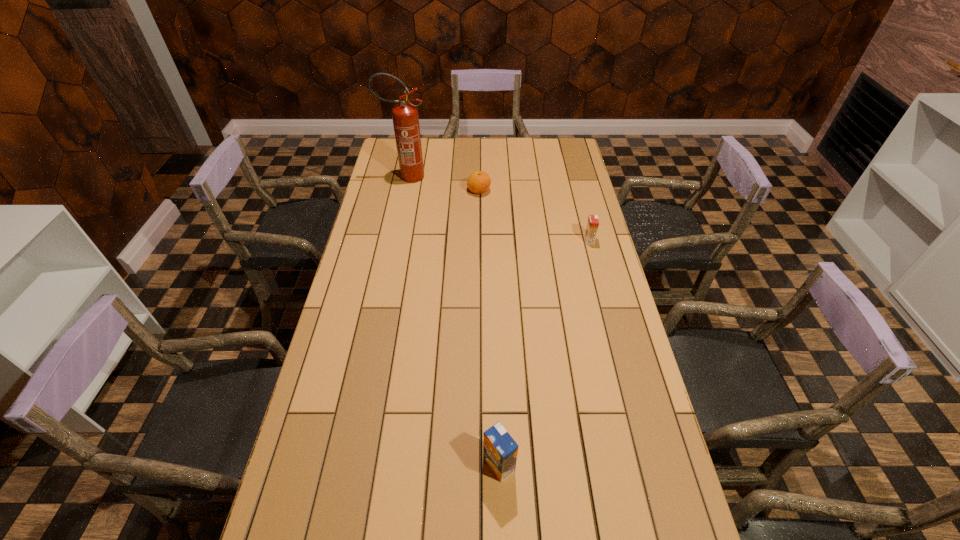
The height and width of the screenshot is (540, 960). In order to click on vacant region located 0.320m on the left of the shorter orange juice in this screenshot , I will do `click(500, 240)`.

You are a GUI agent. You are given a task and a screenshot of the screen. Output one action in this format:
    pyautogui.click(x=<x>, y=<y>)
    Task: Click on the vacant area situated on the front of the clementine
    The height and width of the screenshot is (540, 960).
    Given the screenshot: What is the action you would take?
    pyautogui.click(x=479, y=238)

You are a GUI agent. You are given a task and a screenshot of the screen. Output one action in this format:
    pyautogui.click(x=<x>, y=<y>)
    Task: Click on the object located in the left edge section of the desktop
    The width and height of the screenshot is (960, 540).
    Given the screenshot: What is the action you would take?
    pyautogui.click(x=405, y=117)

The image size is (960, 540). Find the location of `object at the right edge`. object at the right edge is located at coordinates (592, 225).

In the image, there is a desktop. At what (x,y) coordinates should I click in order to perform the action: click on vacant space at the far edge. Please return your answer as a coordinate pair (x, y). Image resolution: width=960 pixels, height=540 pixels. Looking at the image, I should click on pos(470,149).

Image resolution: width=960 pixels, height=540 pixels. I want to click on vacant space at the left edge, so click(x=399, y=185).

At what (x,y) coordinates should I click in order to perform the action: click on vacant space at the right edge of the desktop. Please return your answer as a coordinate pair (x, y). Looking at the image, I should click on (571, 218).

This screenshot has width=960, height=540. What are the coordinates of `free spot at the far right corner of the desktop` in the screenshot? It's located at (564, 148).

At what (x,y) coordinates should I click in order to perform the action: click on vacant area that lies between the nearest object and the farther orange juice. Please return your answer as a coordinate pair (x, y). The width and height of the screenshot is (960, 540). Looking at the image, I should click on (544, 352).

Find the location of a particular element. This screenshot has width=960, height=540. vacant area between the third nearest object and the second tallest object is located at coordinates (489, 327).